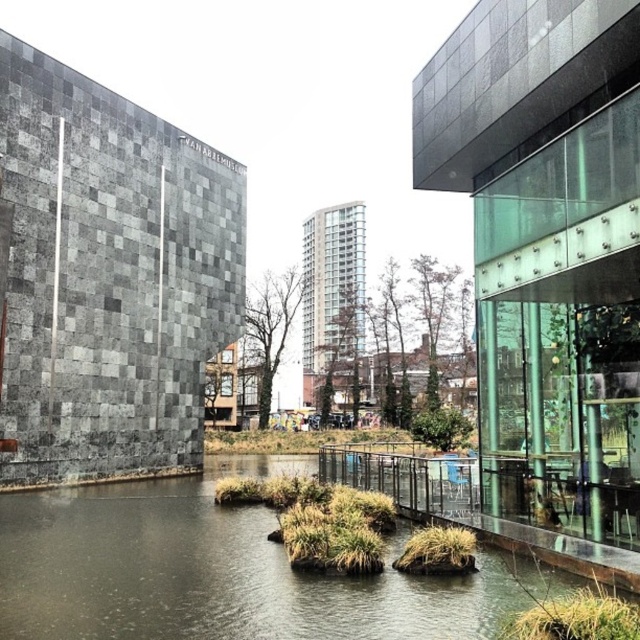
Is dark gray concrete river at center wider than green grass at center?

Yes, dark gray concrete river at center is wider than green grass at center.

Who is lower down, dark gray concrete river at center or green grass at center?

dark gray concrete river at center

This screenshot has width=640, height=640. In order to click on dark gray concrete river at center in this screenshot , I will do pos(221,572).

Is green grass at lower center taller than green grass at center?

Yes, green grass at lower center is taller than green grass at center.

Does green grass at lower center have a larger size compared to green grass at center?

Yes, green grass at lower center is bigger than green grass at center.

What do you see at coordinates (576, 618) in the screenshot?
I see `green grass at lower center` at bounding box center [576, 618].

Where is `green grass at lower center`? This screenshot has height=640, width=640. green grass at lower center is located at coordinates (576, 618).

Is point (83, 595) farther from camera compared to point (564, 636)?

Yes, it is behind point (564, 636).

Between dark gray concrete river at center and green grass at lower center, which one has more height?

dark gray concrete river at center is taller.

Locate an element on the screen. This screenshot has height=640, width=640. dark gray concrete river at center is located at coordinates (221, 572).